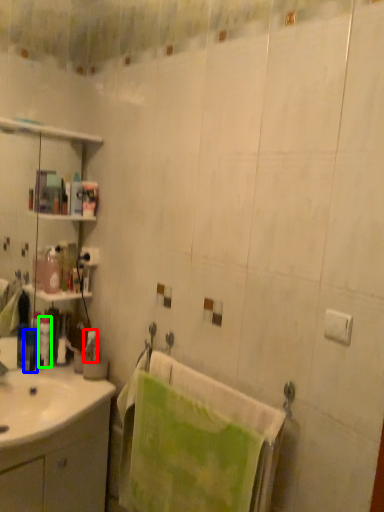
Question: Which object is positioned closest to toiletry (highlighted by a red box)? Select from toiletry (highlighted by a blue box) and toiletry (highlighted by a green box).

Choices:
 (A) toiletry
 (B) toiletry

Answer: (B)